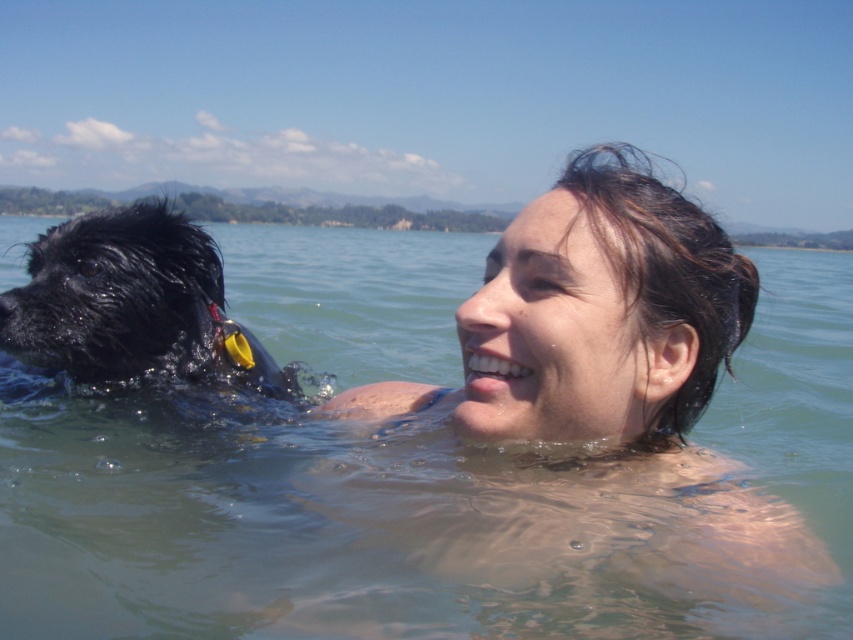
Based on the photo, you are a photographer trying to capture the reflection of the clear water at upper center and the wet black fur at left. Which object is positioned higher in the image?

The clear water at upper center is positioned higher than the wet black fur at left, so its reflection would be captured higher in the image.

You are standing at the point marked as point (440, 513) on the image, which is on clear water at upper center. You want to swim towards the dog wearing a red collar with a yellow tag. In which direction should you swim?

You should swim downward because the dog is below the point marked as point (440, 513) on the image, which is on clear water at upper center.